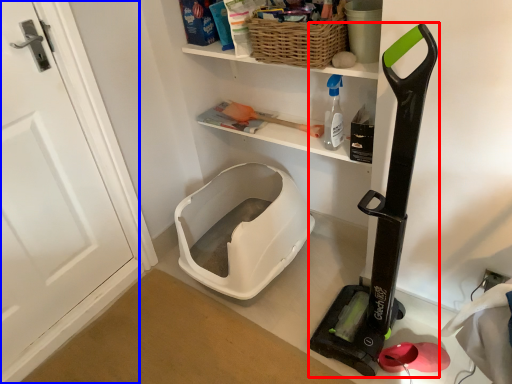
Question: Which point is closer to the camera, appliance (highlighted by a red box) or door (highlighted by a blue box)?

Choices:
 (A) appliance
 (B) door

Answer: (A)